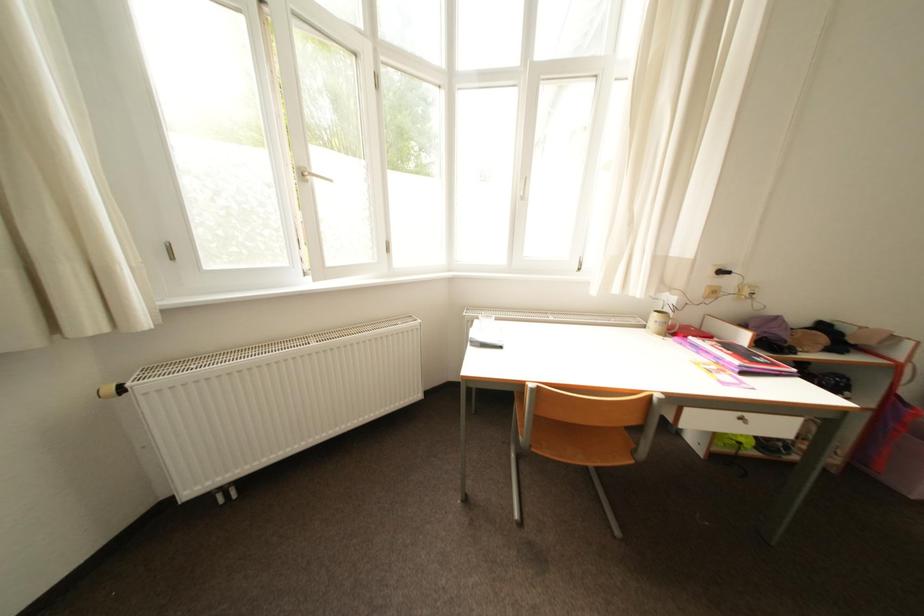
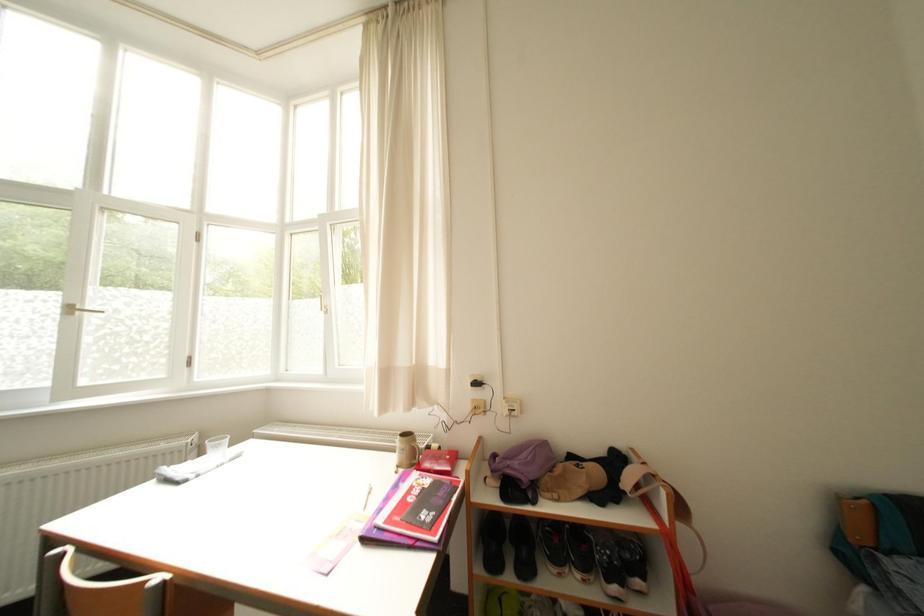
Question: What movement of the cameraman would produce the second image?

Choices:
 (A) Left
 (B) Right
 (C) Forward
 (D) Backward

Answer: (B)